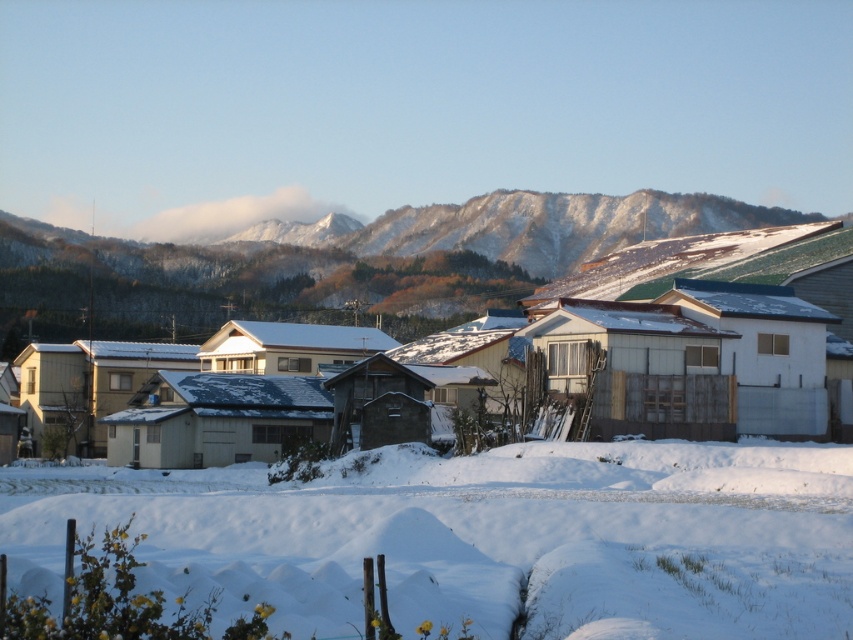
You are standing in the winter landscape and want to take a photo of the snowy mountain at upper center. To avoid blocking the view, should you move forward or backward from the white fluffy snow at center?

You should move backward from the white fluffy snow at center because it is positioned under the snowy mountain at upper center, so moving back would allow the mountain to be visible without obstruction.

You are standing in the winter landscape and want to walk towards the snowy mountain at upper center. Which direction should you move relative to the white fluffy snow at center?

You should move to the right relative to the white fluffy snow at center because the snowy mountain at upper center is to the right of the white fluffy snow at center.

You are standing at the point marked by the coordinate point at point [482,536] in the image. Looking around, you see white fluffy snow at center. What is directly under your feet?

The point at [482,536] marks the white fluffy snow at center, so the area directly under your feet is covered in white fluffy snow.